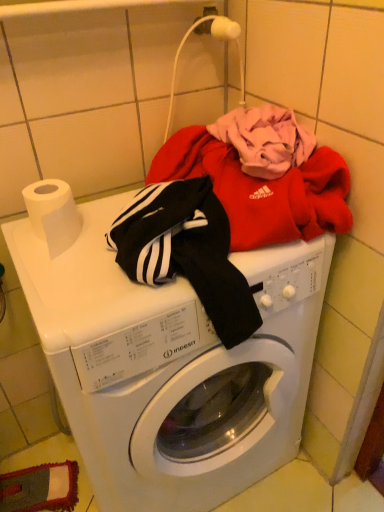
Image resolution: width=384 pixels, height=512 pixels. Find the location of `vacant area to the right of white matte toilet paper at left`. vacant area to the right of white matte toilet paper at left is located at coordinates (110, 249).